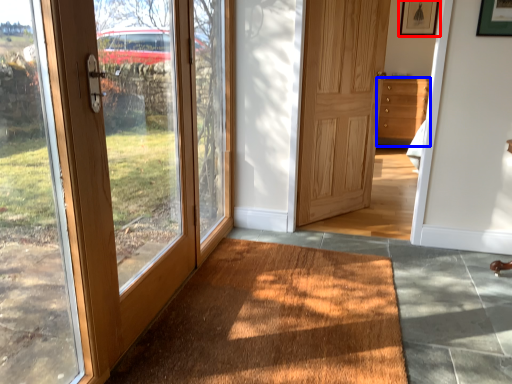
Question: Which point is closer to the camera, picture frame (highlighted by a red box) or chest of drawers (highlighted by a blue box)?

Choices:
 (A) picture frame
 (B) chest of drawers

Answer: (B)